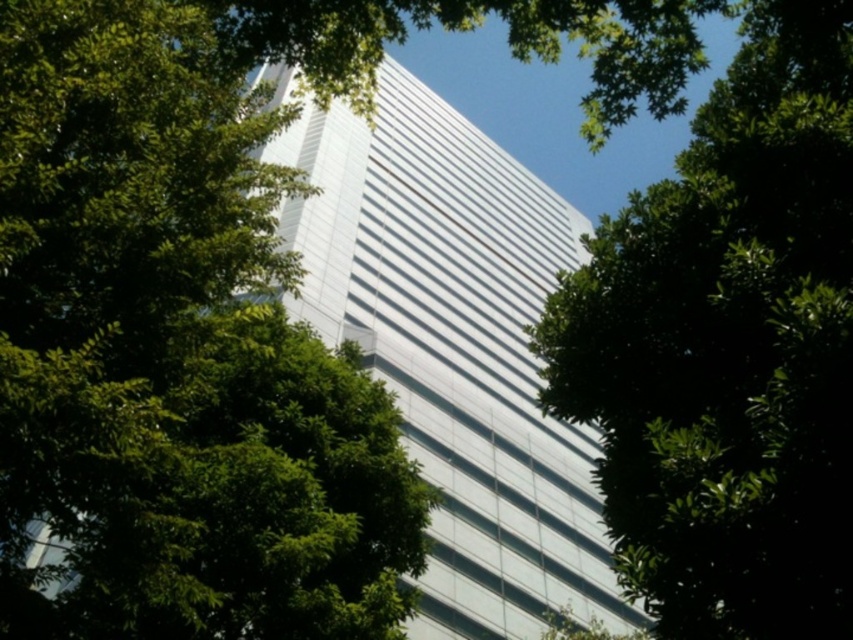
From the picture: You are standing at the base of the modern highrise building and looking up. There is a point marked at coordinates (173, 355). What object is located at that point?

The point at (173, 355) indicates a green leafy tree at upper left.

You are an architect observing the white glass building at center and the green leafy tree at center. Which object is closer to the right edge of the image?

The green leafy tree at center is positioned on the right side of white glass building at center, so it is closer to the right edge of the image.